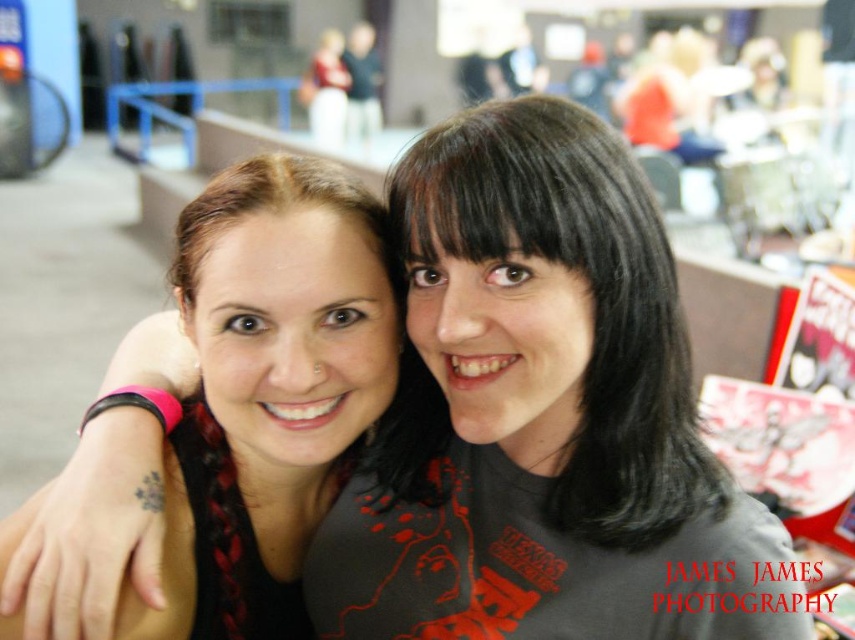
Question: Among these objects, which one is farthest from the camera?

Choices:
 (A) black matte hair at center
 (B) matte black shirt at center

Answer: (B)

Question: Which object appears closest to the camera in this image?

Choices:
 (A) black matte hair at center
 (B) matte black shirt at center

Answer: (A)

Question: Is black matte hair at center thinner than matte black shirt at center?

Choices:
 (A) yes
 (B) no

Answer: (B)

Question: Is black matte hair at center wider than matte black shirt at center?

Choices:
 (A) yes
 (B) no

Answer: (A)

Question: Is black matte hair at center closer to camera compared to matte black shirt at center?

Choices:
 (A) no
 (B) yes

Answer: (B)